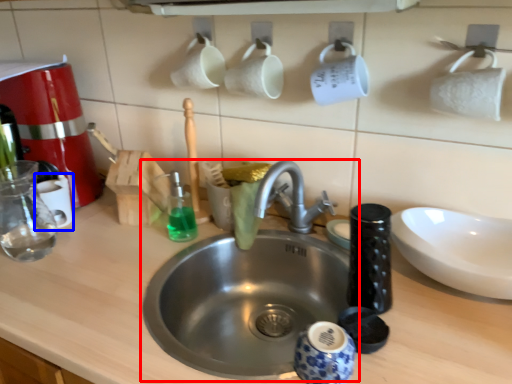
Question: Which object is closer to the camera taking this photo, sink (highlighted by a red box) or mug (highlighted by a blue box)?

Choices:
 (A) sink
 (B) mug

Answer: (A)